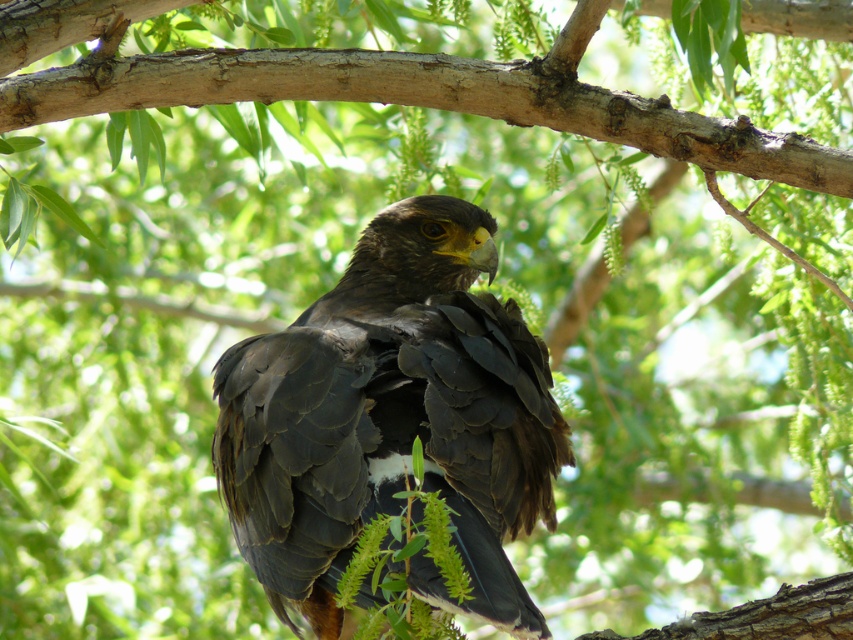
You are a wildlife photographer aiming to capture a closeup of the dark brown feathers at center and the smooth brown branch at center in the image. Your camera has a maximum focus range of 14 inches. Can you focus on both objects simultaneously?

The dark brown feathers at center and the smooth brown branch at center are 14.21 inches apart. Since the distance between them exceeds the camera maximum focus range of 14 inches, you cannot focus on both objects simultaneously.

You are a nature photographer trying to capture the hawk in the image. You notice the dark brown feathers at center and the smooth brown branch at center. Which object is located above the other?

The dark brown feathers at center is positioned under the smooth brown branch at center, so the smooth brown branch at center is above the dark brown feathers at center.